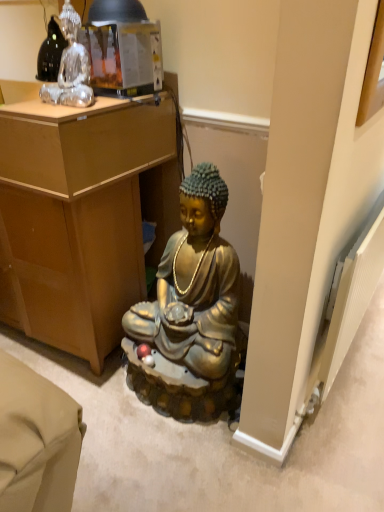
What is the approximate width of silver metallic statue at upper left?

The width of silver metallic statue at upper left is 5.58 inches.

What do you see at coordinates (71, 67) in the screenshot?
I see `silver metallic statue at upper left` at bounding box center [71, 67].

You are a GUI agent. You are given a task and a screenshot of the screen. Output one action in this format:
    pyautogui.click(x=<x>, y=<y>)
    Task: Click on the silver metallic statue at upper left
    This screenshot has height=512, width=384.
    Given the screenshot: What is the action you would take?
    pyautogui.click(x=71, y=67)

Find the location of a particular element. Image resolution: width=384 pixels, height=512 pixels. silver metallic statue at upper left is located at coordinates (71, 67).